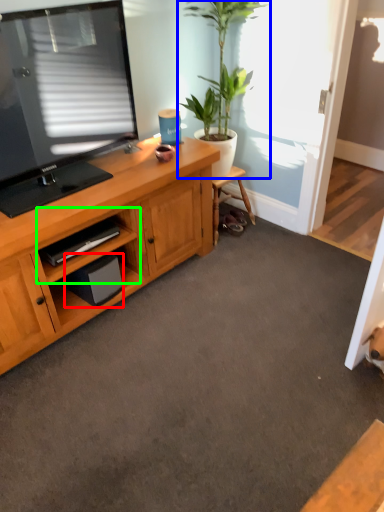
Question: Based on their relative distances, which object is nearer to speaker (highlighted by a red box)? Choose from houseplant (highlighted by a blue box) and cabinet (highlighted by a green box).

Choices:
 (A) houseplant
 (B) cabinet

Answer: (B)